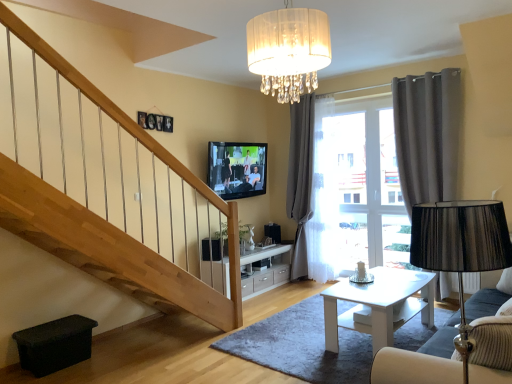
Describe the element at coordinates (237, 169) in the screenshot. I see `flat screen tv at upper center` at that location.

Find the location of a particular element. This screenshot has height=384, width=512. flat screen tv at upper center is located at coordinates click(x=237, y=169).

In the scene shown: Measure the distance between velvet blue sofa at lower right and camera.

5.63 feet.

What are the coordinates of `white glossy coffee table at center` in the screenshot? It's located at (380, 305).

The width and height of the screenshot is (512, 384). Describe the element at coordinates (266, 268) in the screenshot. I see `light wood/veneer cabinet at center` at that location.

I want to click on flat screen tv at upper center, so click(237, 169).

Is the surface of velvet blue sofa at lower right in direct contact with light wood/veneer cabinet at center?

No, velvet blue sofa at lower right is not in contact with light wood/veneer cabinet at center.

From the image's perspective, which one is positioned lower, velvet blue sofa at lower right or light wood/veneer cabinet at center?

light wood/veneer cabinet at center.

Considering the relative positions of velvet blue sofa at lower right and light wood/veneer cabinet at center in the image provided, is velvet blue sofa at lower right to the left of light wood/veneer cabinet at center from the viewer's perspective?

No, velvet blue sofa at lower right is not to the left of light wood/veneer cabinet at center.

From the picture: Does velvet blue sofa at lower right turn towards light wood/veneer cabinet at center?

Yes, velvet blue sofa at lower right faces towards light wood/veneer cabinet at center.

Can light wood/veneer cabinet at center be found inside flat screen tv at upper center?

No.

Does flat screen tv at upper center appear on the right side of light wood/veneer cabinet at center?

Incorrect, flat screen tv at upper center is not on the right side of light wood/veneer cabinet at center.

From a real-world perspective, is flat screen tv at upper center physically below light wood/veneer cabinet at center?

No, from a real-world perspective, flat screen tv at upper center is not under light wood/veneer cabinet at center.

Would you consider flat screen tv at upper center to be distant from light wood/veneer cabinet at center?

Yes, flat screen tv at upper center and light wood/veneer cabinet at center are quite far apart.

Is light wood/veneer cabinet at center facing towards flat screen tv at upper center?

No, light wood/veneer cabinet at center is not facing towards flat screen tv at upper center.

Who is taller, light wood/veneer cabinet at center or flat screen tv at upper center?

flat screen tv at upper center is taller.

Based on the photo, from a real-world perspective, who is located higher, light wood/veneer cabinet at center or flat screen tv at upper center?

flat screen tv at upper center is physically above.

Is white sheer curtain at center, which is the 2th curtain in front-to-back order, facing away from light wood/veneer cabinet at center?

white sheer curtain at center, which is the 2th curtain in front-to-back order, is not turned away from light wood/veneer cabinet at center.

Which of these two, white sheer curtain at center, the 2th curtain positioned from the right, or light wood/veneer cabinet at center, is wider?

With larger width is white sheer curtain at center, the 2th curtain positioned from the right.

Based on the photo, from the image's perspective, which is below, white sheer curtain at center, which is the 2th curtain in front-to-back order, or light wood/veneer cabinet at center?

light wood/veneer cabinet at center.

How different are the orientations of white sheer curtain at center, the 2th curtain positioned from the right, and light wood/veneer cabinet at center in degrees?

The angular difference between white sheer curtain at center, the 2th curtain positioned from the right, and light wood/veneer cabinet at center is 93.3 degrees.

Is light wood/veneer cabinet at center not close to velvet blue sofa at lower right?

That's right, there is a large distance between light wood/veneer cabinet at center and velvet blue sofa at lower right.

Which is less distant, [254,251] or [404,373]?

Point [254,251] appears to be farther away from the viewer than point [404,373].

Is light wood/veneer cabinet at center to the left or to the right of velvet blue sofa at lower right in the image?

Clearly, light wood/veneer cabinet at center is on the left of velvet blue sofa at lower right in the image.

Is light wood/veneer cabinet at center closer to camera compared to velvet blue sofa at lower right?

No.

Is white glossy coffee table at center turned away from velvet blue sofa at lower right?

Yes, white glossy coffee table at center is positioned with its back facing velvet blue sofa at lower right.

Is white glossy coffee table at center far from velvet blue sofa at lower right?

white glossy coffee table at center is positioned a significant distance from velvet blue sofa at lower right.

From a real-world perspective, who is located lower, white glossy coffee table at center or velvet blue sofa at lower right?

white glossy coffee table at center.

From the image's perspective, which object appears higher, dark gray fabric curtain at right, which ranks as the 2th curtain in back-to-front order, or light wood/veneer cabinet at center?

From the image's view, dark gray fabric curtain at right, which ranks as the 2th curtain in back-to-front order, is above.

Can you confirm if dark gray fabric curtain at right, which ranks as the 2th curtain in back-to-front order, is shorter than light wood/veneer cabinet at center?

In fact, dark gray fabric curtain at right, which ranks as the 2th curtain in back-to-front order, may be taller than light wood/veneer cabinet at center.

Which point is more distant from viewer, (404, 101) or (220, 272)?

The point (404, 101) is farther from the camera.

Is dark gray fabric curtain at right, which is counted as the 2th curtain, starting from the left, facing towards light wood/veneer cabinet at center?

No, dark gray fabric curtain at right, which is counted as the 2th curtain, starting from the left, does not turn towards light wood/veneer cabinet at center.

Where is `cabinetry located on the left of velvet blue sofa at lower right`? cabinetry located on the left of velvet blue sofa at lower right is located at coordinates (266, 268).

Locate an element on the screen. This screenshot has width=512, height=384. cabinetry lying on the right of flat screen tv at upper center is located at coordinates (266, 268).

Considering their positions, is translucent fabric chandelier at upper center positioned closer to white sheer curtain at center, which is the 2th curtain in front-to-back order, than dark gray fabric curtain at right, which is counted as the 2th curtain, starting from the left?

dark gray fabric curtain at right, which is counted as the 2th curtain, starting from the left, is positioned closer to the anchor white sheer curtain at center, which is the 2th curtain in front-to-back order.

Which object lies nearer to the anchor point white sheer curtain at center, which is the 2th curtain in front-to-back order, dark gray fabric curtain at right, positioned as the 1th curtain in right-to-left order, or translucent fabric chandelier at upper center?

dark gray fabric curtain at right, positioned as the 1th curtain in right-to-left order, lies closer to white sheer curtain at center, which is the 2th curtain in front-to-back order, than the other object.

From the image, which object appears to be nearer to flat screen tv at upper center, white glossy coffee table at center or velvet blue sofa at lower right?

Among the two, white glossy coffee table at center is located nearer to flat screen tv at upper center.

Estimate the real-world distances between objects in this image. Which object is further from flat screen tv at upper center, light wood/veneer cabinet at center or translucent fabric chandelier at upper center?

Based on the image, translucent fabric chandelier at upper center appears to be further to flat screen tv at upper center.

Consider the image. Based on their spatial positions, is light wood/veneer cabinet at center or velvet blue sofa at lower right closer to white sheer curtain at center, which is the 1th curtain from back to front?

light wood/veneer cabinet at center.

When comparing their distances from white glossy coffee table at center, does flat screen tv at upper center or translucent fabric chandelier at upper center seem closer?

translucent fabric chandelier at upper center is closer to white glossy coffee table at center.

From the image, which object appears to be farther from white sheer curtain at center, the 2th curtain positioned from the right, translucent fabric chandelier at upper center or flat screen tv at upper center?

Based on the image, translucent fabric chandelier at upper center appears to be further to white sheer curtain at center, the 2th curtain positioned from the right.

Considering their positions, is translucent fabric chandelier at upper center positioned further to flat screen tv at upper center than light wood/veneer cabinet at center?

Based on the image, translucent fabric chandelier at upper center appears to be further to flat screen tv at upper center.

Find the location of a particular element. This screenshot has height=384, width=512. curtain between translucent fabric chandelier at upper center and white sheer curtain at center, the 2th curtain positioned from the right, in the front-back direction is located at coordinates (428, 135).

Identify the location of curtain between velvet blue sofa at lower right and flat screen tv at upper center in the front-back direction. (428, 135).

Identify the location of coffee table between translucent fabric chandelier at upper center and dark gray fabric curtain at right, which ranks as the first curtain in front-to-back order, along the z-axis. The height and width of the screenshot is (384, 512). (380, 305).

In order to click on curtain between white glossy coffee table at center and white sheer curtain at center, the 2th curtain positioned from the right, from front to back in this screenshot , I will do `click(428, 135)`.